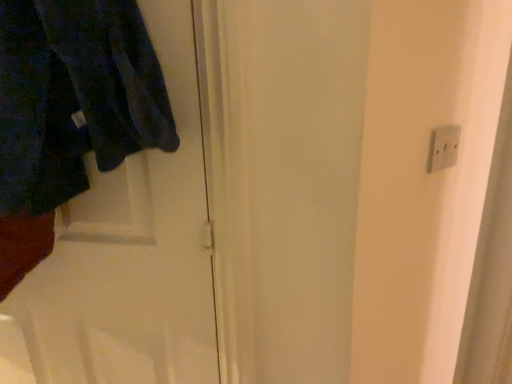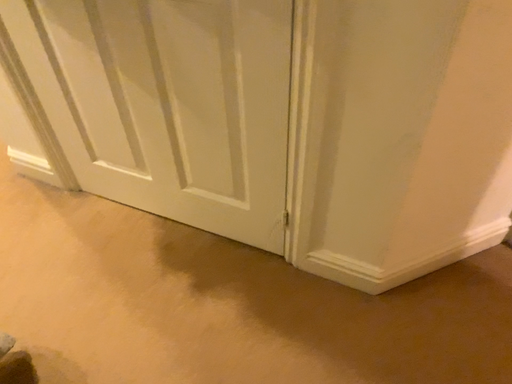
Question: Which way did the camera rotate in the video?

Choices:
 (A) rotated upward
 (B) rotated downward

Answer: (B)